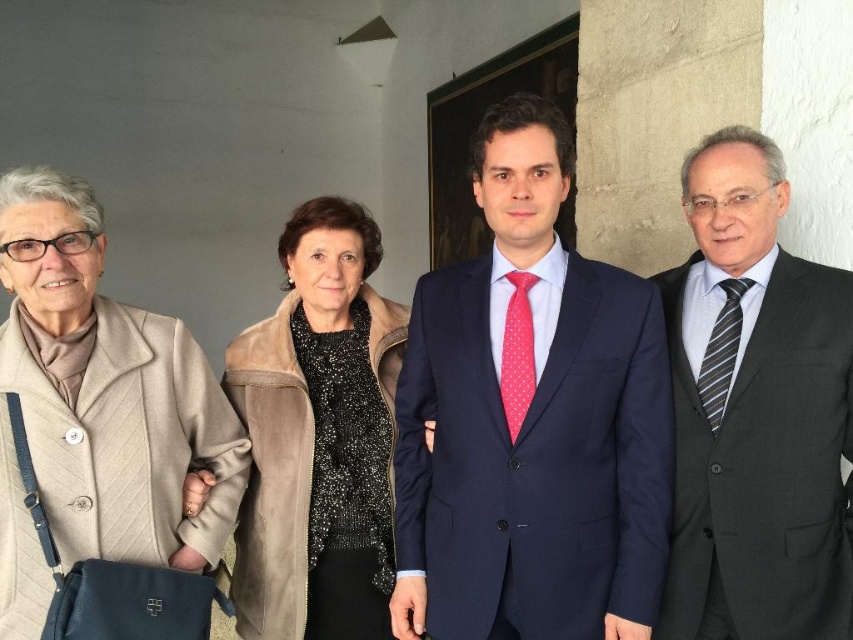
Can you confirm if navy blue suit at center is positioned above suede jacket at center?

Indeed, navy blue suit at center is positioned over suede jacket at center.

Does navy blue suit at center have a larger size compared to suede jacket at center?

No, navy blue suit at center is not bigger than suede jacket at center.

Does point (624, 280) come in front of point (354, 273)?

Yes.

Where is `navy blue suit at center`? The image size is (853, 640). navy blue suit at center is located at coordinates (531, 422).

Measure the distance between dark gray suit at right and pink dotted fabric tie at center.

dark gray suit at right and pink dotted fabric tie at center are 19.33 inches apart from each other.

Who is higher up, dark gray suit at right or pink dotted fabric tie at center?

Positioned higher is pink dotted fabric tie at center.

Which is in front, point (732, 454) or point (514, 388)?

Positioned in front is point (514, 388).

Locate an element on the screen. The image size is (853, 640). dark gray suit at right is located at coordinates (755, 412).

Between dark gray suit at right and suede jacket at center, which one is positioned lower?

suede jacket at center is below.

Between dark gray suit at right and suede jacket at center, which one appears on the left side from the viewer's perspective?

From the viewer's perspective, suede jacket at center appears more on the left side.

Does point (738, 237) lie in front of point (308, 424)?

That is True.

The height and width of the screenshot is (640, 853). Identify the location of dark gray suit at right. (755, 412).